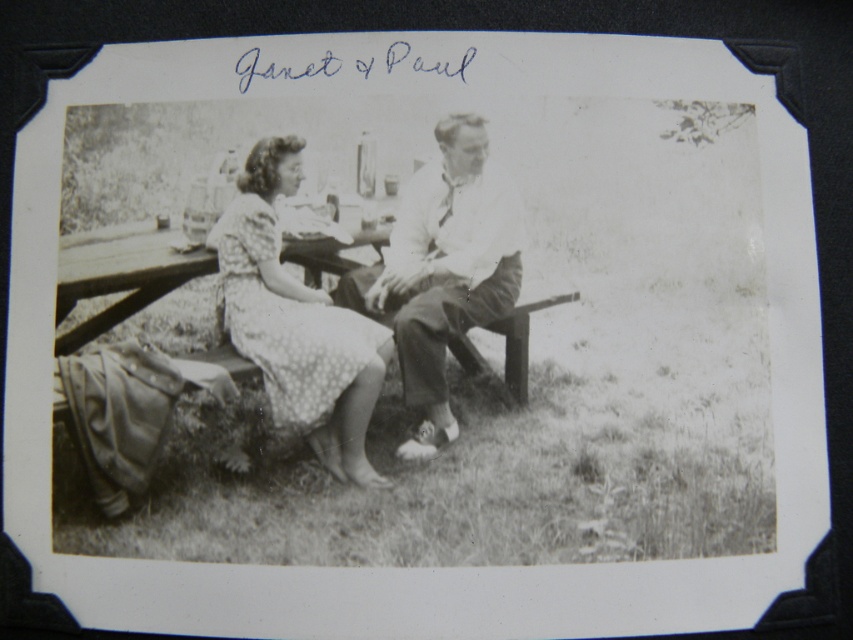
Can you confirm if smooth white shirt at center is positioned above dotted fabric dress at center-left?

Yes, smooth white shirt at center is above dotted fabric dress at center-left.

Which is in front, point (439, 205) or point (337, 310)?

Point (439, 205) is more forward.

Where is `smooth white shirt at center`? smooth white shirt at center is located at coordinates (442, 273).